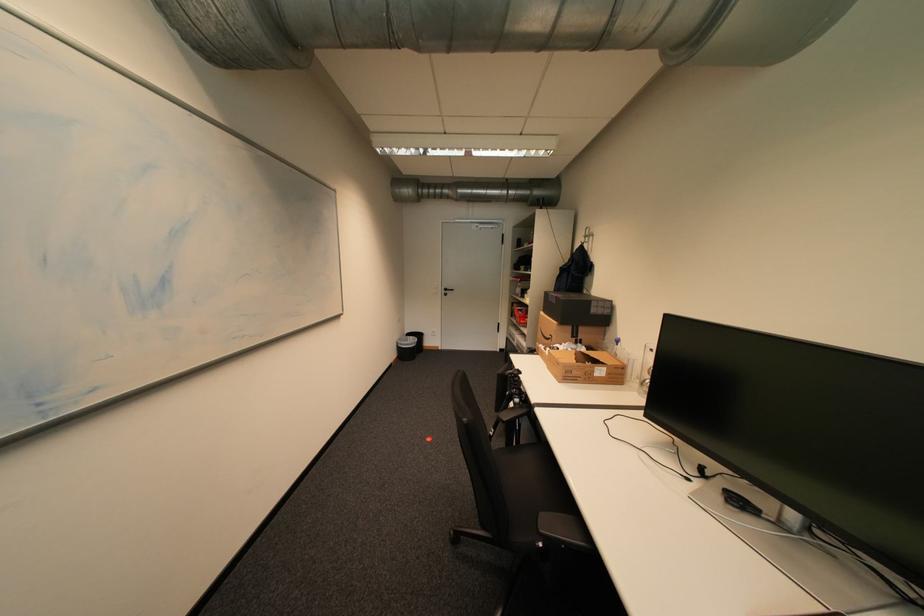
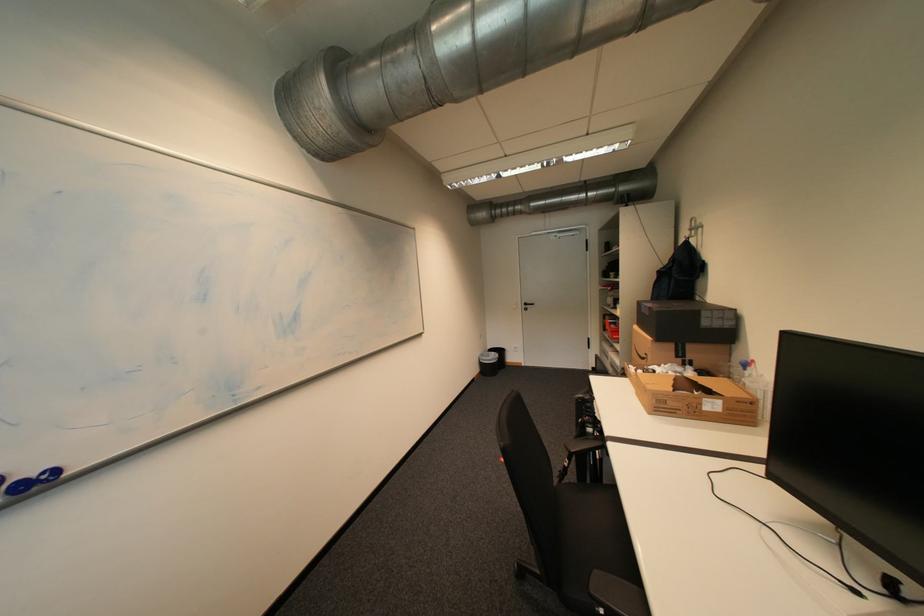
Question: In a continuous first-person perspective shot, in which direction is the camera moving?

Choices:
 (A) Left
 (B) Right
 (C) Forward
 (D) Backward

Answer: (B)